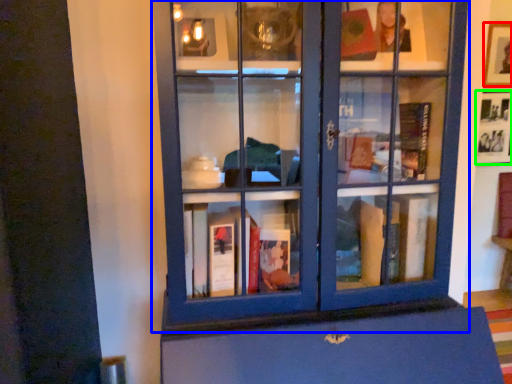
Question: Which object is the closest to the picture frame (highlighted by a red box)? Choose among these: bookcase (highlighted by a blue box) or picture frame (highlighted by a green box).

Choices:
 (A) bookcase
 (B) picture frame

Answer: (B)